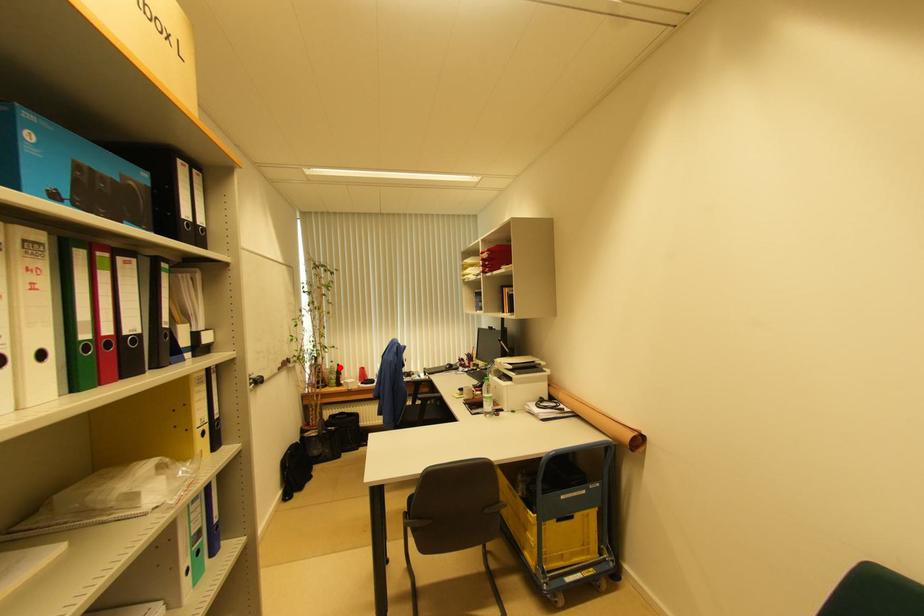
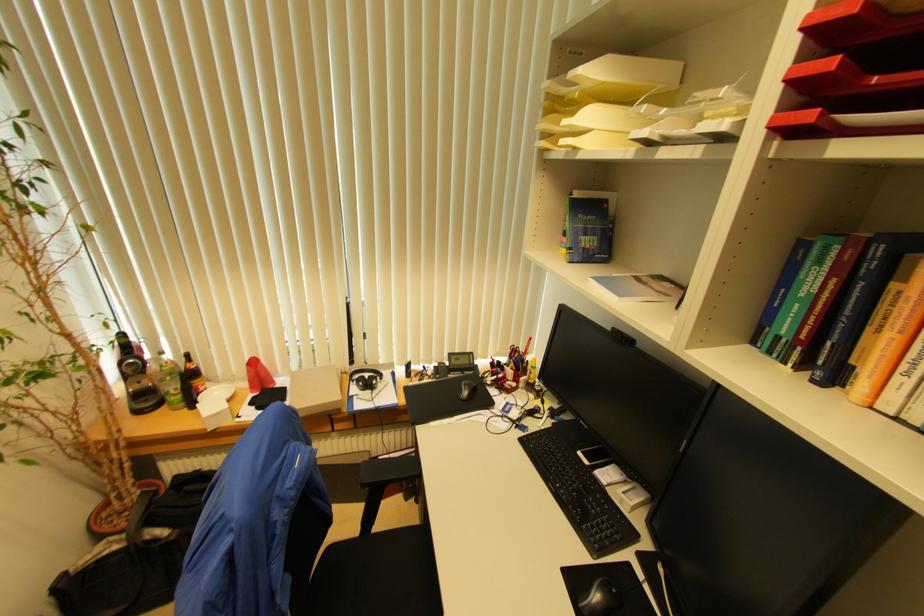
In the second image, find the point that corresponds to the highlighted location in the first image.

(188, 358)